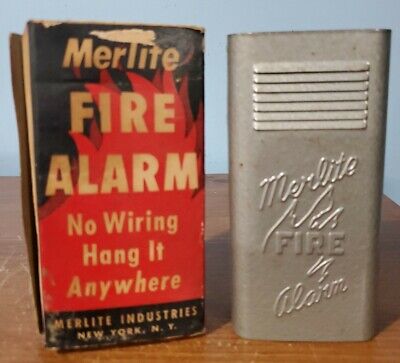
Find the location of a particular element. The width and height of the screenshot is (400, 363). table is located at coordinates (220, 338).